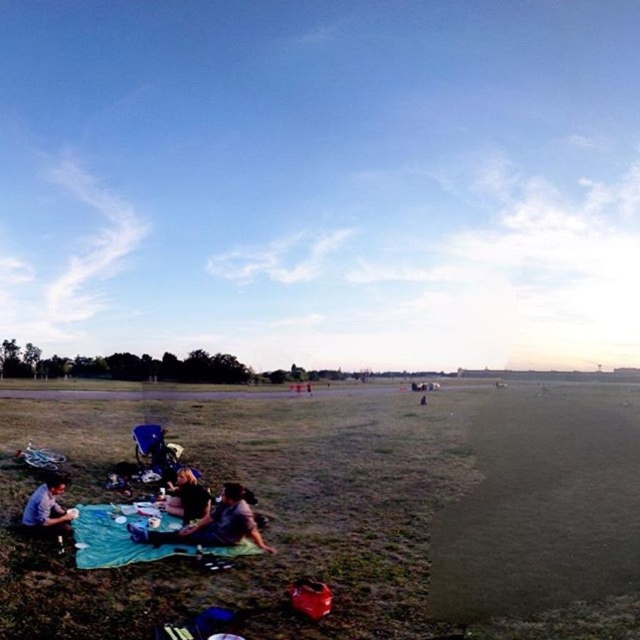
Does green grass picnic blanket at lower left have a greater height compared to blue fabric picnic blanket at lower left?

Yes.

Is point (504, 568) closer to viewer compared to point (160, 518)?

Yes, it is in front of point (160, 518).

Does point (336, 596) come farther from viewer compared to point (81, 536)?

That is False.

This screenshot has width=640, height=640. I want to click on green grass picnic blanket at lower left, so click(349, 506).

Does blue fabric picnic blanket at lower left have a greater width compared to dark brown hair at lower left?

Indeed, blue fabric picnic blanket at lower left has a greater width compared to dark brown hair at lower left.

Consider the image. Who is positioned more to the left, blue fabric picnic blanket at lower left or dark brown hair at lower left?

dark brown hair at lower left

Identify the location of blue fabric picnic blanket at lower left. The height and width of the screenshot is (640, 640). (113, 538).

Locate an element on the screen. green grass picnic blanket at lower left is located at coordinates (349, 506).

Where is `green grass picnic blanket at lower left`? The image size is (640, 640). green grass picnic blanket at lower left is located at coordinates (349, 506).